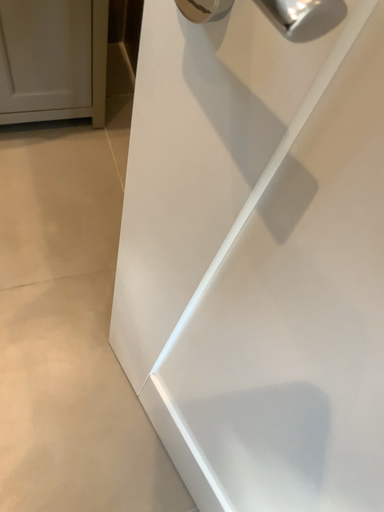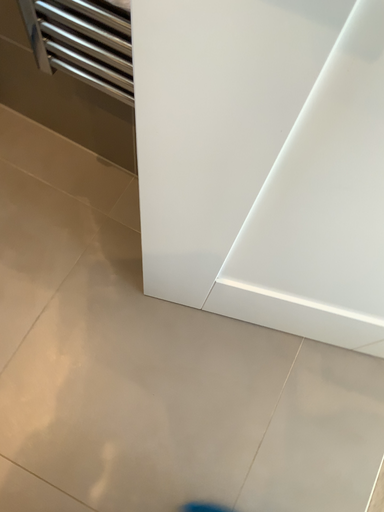
Question: Which way did the camera rotate in the video?

Choices:
 (A) rotated upward
 (B) rotated downward

Answer: (B)